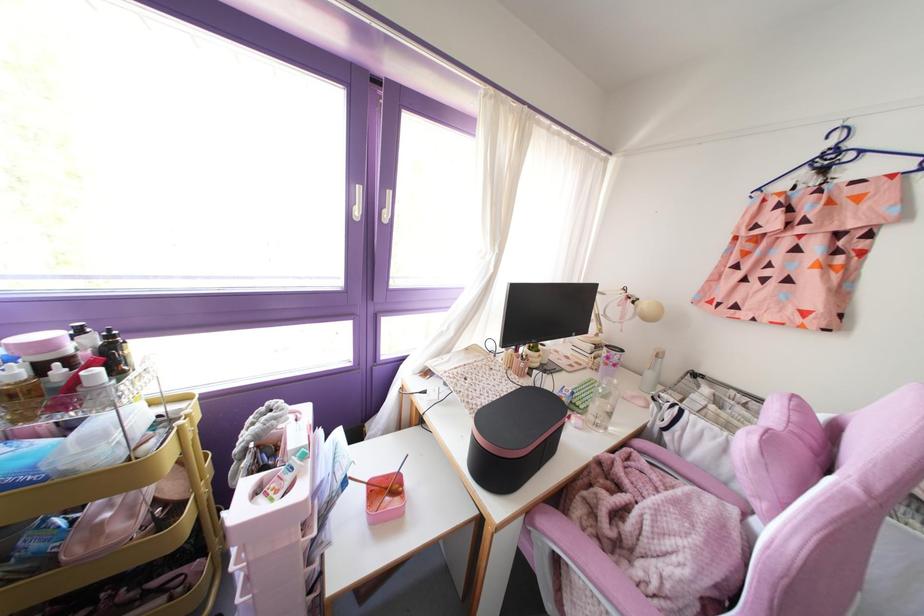
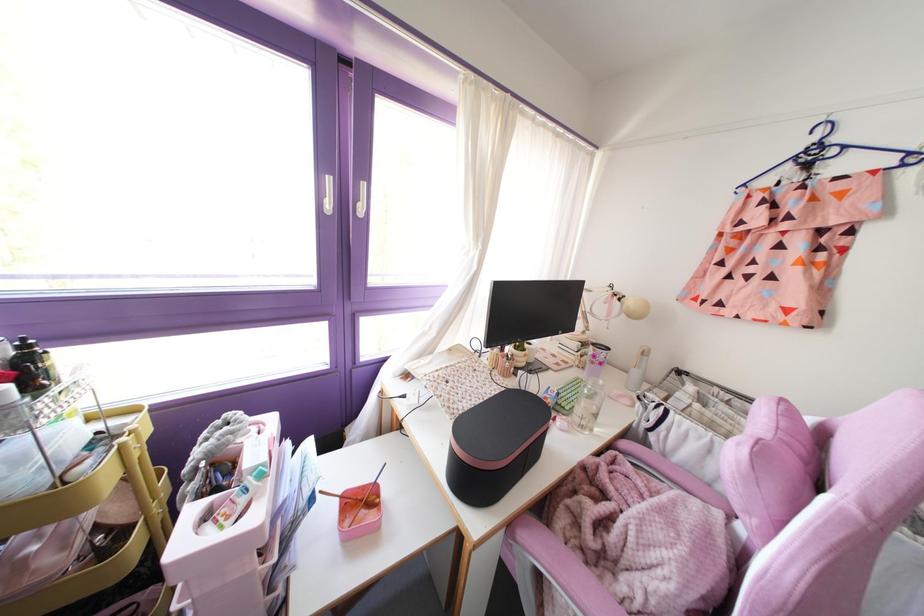
The point at (393, 472) is marked in the first image. Where is the corresponding point in the second image?

(370, 484)